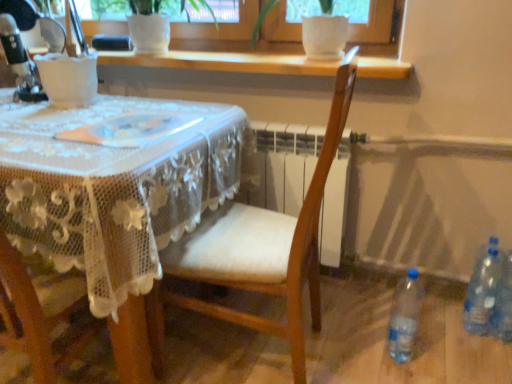
Find the location of a particular element. This screenshot has height=384, width=512. vacant space that is in between transparent plastic bottle at lower right, the 3th bottle when ordered from right to left, and clear plastic bottle at lower right, which ranks as the second bottle in right-to-left order is located at coordinates (437, 342).